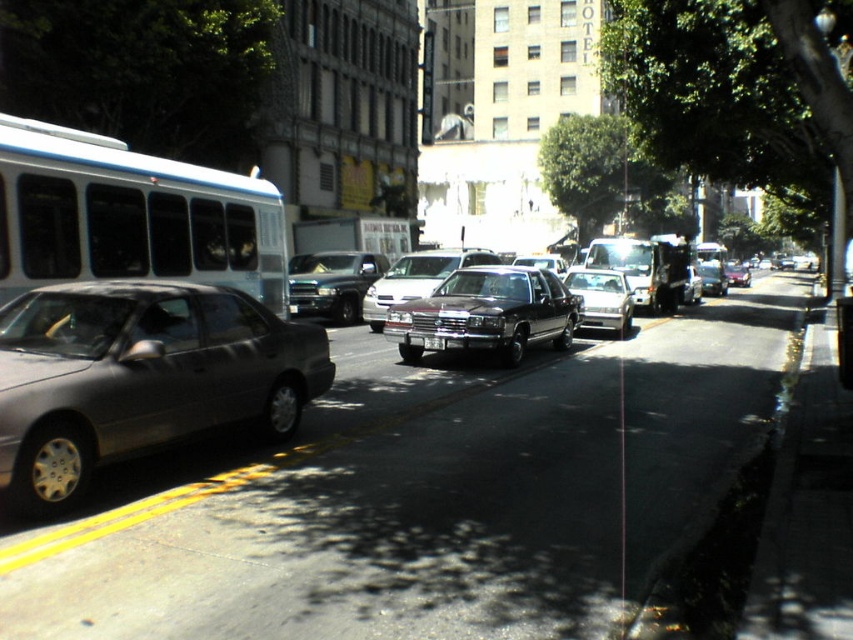
You are a delivery driver who needs to park your truck in the middle of the street. The street has parked cars on both sides and a shiny black truck at center. Where should you park your truck?

The shiny black truck at center is already parked at point (332, 284), so you should park your truck in another available spot away from that location to avoid blocking traffic.

You are standing at the side of the road looking down the street. There are two points marked on the road ahead of you. The first point is at coordinates point(x=444, y=275) and the second point is at point(x=577, y=276). Which point is closer to your current position?

Point(x=444, y=275) is closer to the camera than point(x=577, y=276).

You are a delivery driver who needs to park your vehicle between two parked cars on the street. You see the shiny black sedan at center and the silver metallic license plate at center. Which vehicle should you avoid parking next to if you want to ensure enough space for your delivery van?

You should avoid parking next to the shiny black sedan at center because its width surpasses that of the silver metallic license plate at center, meaning there might be less available space between it and other vehicles.